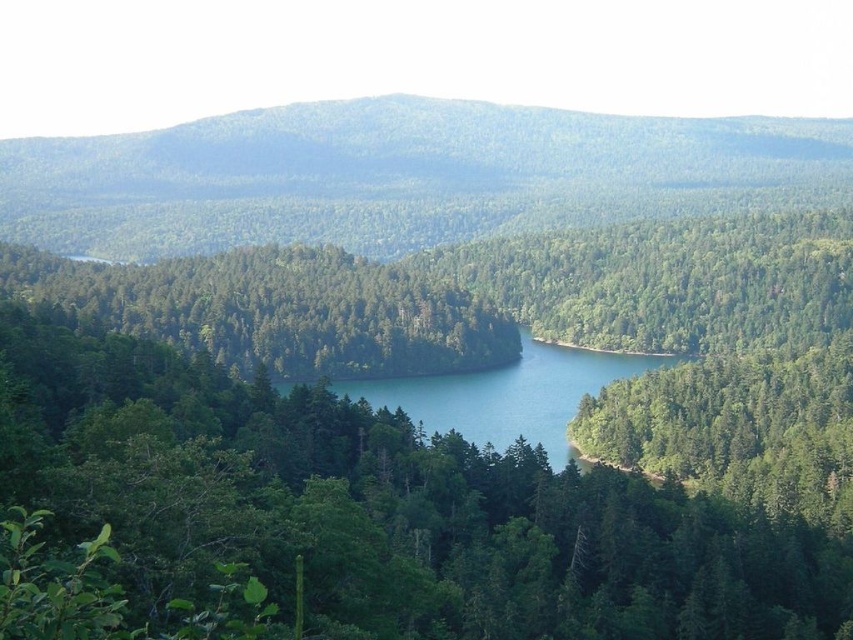
From the picture: You are a hiker standing at the edge of the forest. You see the green matte tree at center and the green forested mountain at upper center. Which object is closer to you?

The green matte tree at center is closer to you because it is located below the green forested mountain at upper center, which is further away in the background.

In the scene shown: You are a hiker who wants to take a photo of both the green matte tree at center and the green forested mountain at upper center in the same frame. Your camera has a maximum zoom range that can capture objects up to 200 meters apart. Can you capture both in one photo without moving your position?

The green matte tree at center is 189.48 meters from the green forested mountain at upper center. Since the distance between them is within the camera maximum zoom range of 200 meters, you can capture both in one photo without moving your position.

You are an environmental scientist assessing the ecological health of this area. You notice the green matte tree at center and the green forested mountain at upper center. Which of these two features takes up more visual space in the image?

The green forested mountain at upper center occupies more visual space than the green matte tree at center.